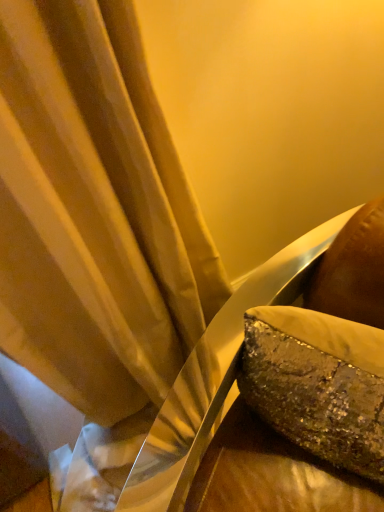
The height and width of the screenshot is (512, 384). What are the coordinates of `shiny metallic bag at right` in the screenshot? It's located at (271, 474).

The height and width of the screenshot is (512, 384). Describe the element at coordinates (271, 474) in the screenshot. I see `shiny metallic bag at right` at that location.

In order to face shiny metallic bag at right, should I rotate leftwards or rightwards?

You should rotate right by 17.192 degrees.

Locate an element on the screen. Image resolution: width=384 pixels, height=512 pixels. shiny metallic bag at right is located at coordinates (271, 474).